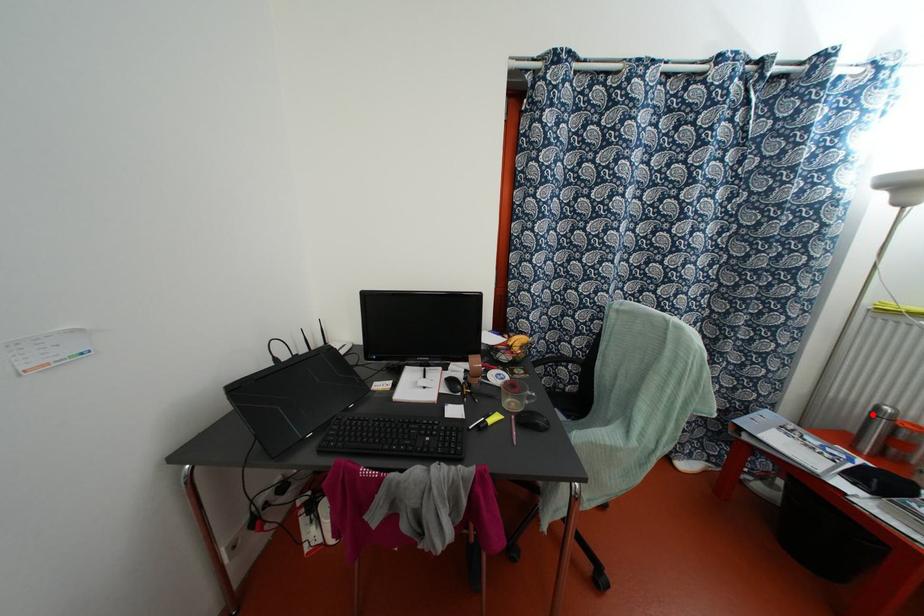
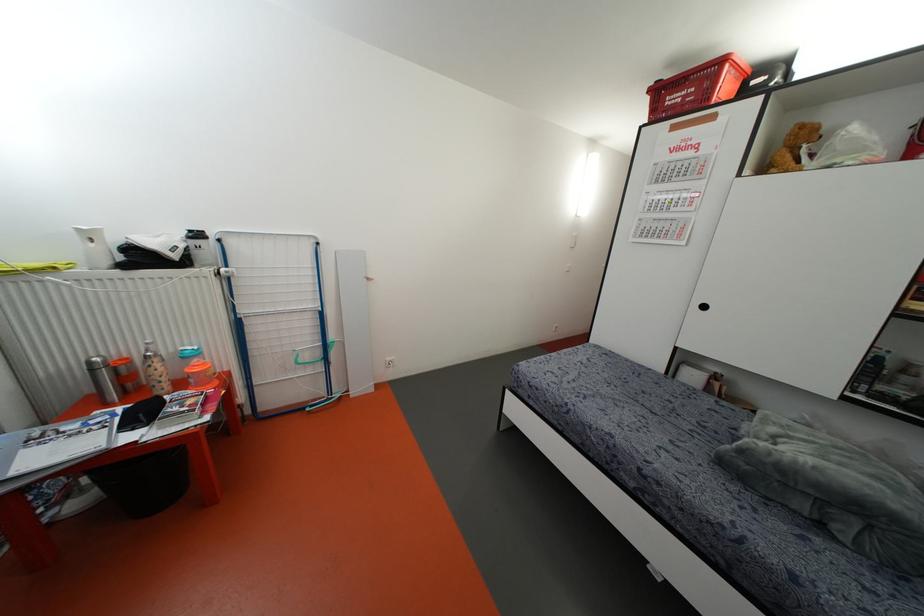
Find the pixel in the second image that matches the highlighted location in the first image.

(91, 370)